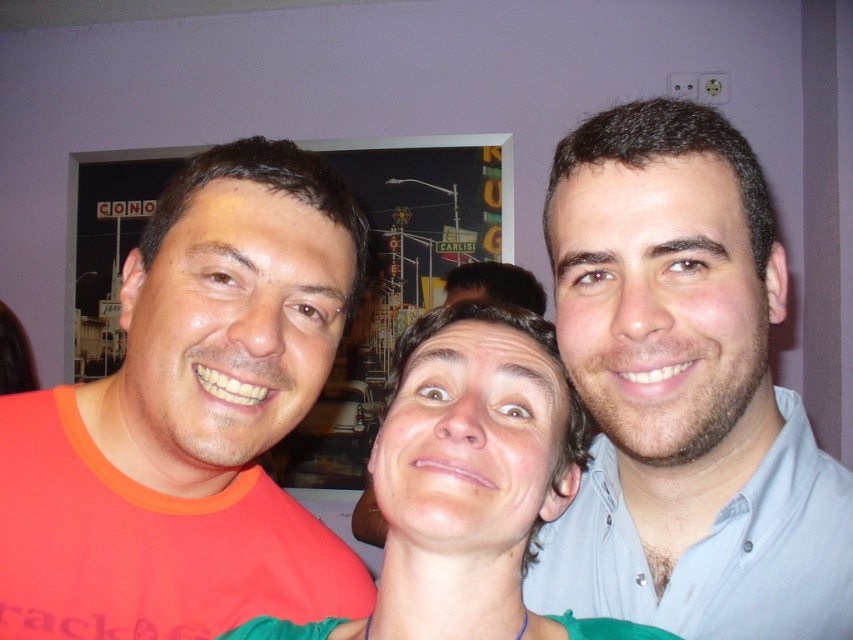
Question: Where is light blue shirt at right located in relation to smooth skin face at center in the image?

Choices:
 (A) left
 (B) right

Answer: (B)

Question: Does orange cotton t-shirt at left appear on the left side of light blue shirt at right?

Choices:
 (A) no
 (B) yes

Answer: (B)

Question: Does light blue shirt at right appear over smooth skin face at center?

Choices:
 (A) no
 (B) yes

Answer: (B)

Question: Estimate the real-world distances between objects in this image. Which object is farther from the light blue shirt at right?

Choices:
 (A) orange cotton t-shirt at left
 (B) smooth skin face at center

Answer: (A)

Question: Estimate the real-world distances between objects in this image. Which object is farther from the smooth skin face at center?

Choices:
 (A) light blue shirt at right
 (B) orange cotton t-shirt at left

Answer: (B)

Question: Which object is the farthest from the light blue shirt at right?

Choices:
 (A) orange cotton t-shirt at left
 (B) smooth skin face at center

Answer: (A)